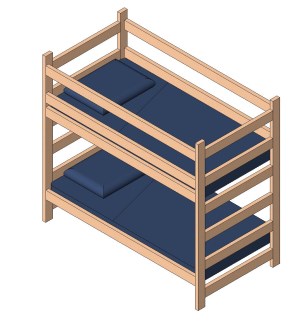
Locate an element on the screen. This screenshot has height=330, width=289. pillow is located at coordinates (103, 174).